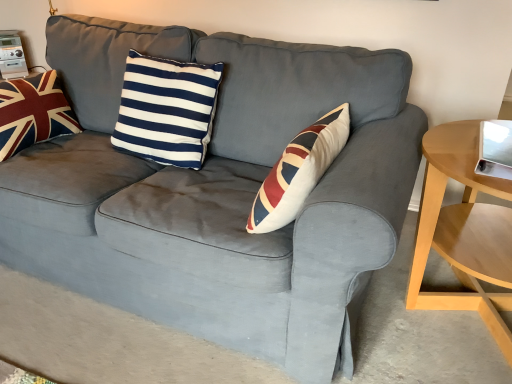
Question: Does light wood/woodenobject at right turn towards navy/white striped cushion at center, the 1th pillow positioned from the right?

Choices:
 (A) no
 (B) yes

Answer: (A)

Question: From the image's perspective, is light wood/woodenobject at right under navy/white striped cushion at center, the 1th pillow positioned from the right?

Choices:
 (A) yes
 (B) no

Answer: (A)

Question: Is light wood/woodenobject at right closer to camera compared to navy/white striped cushion at center, which ranks as the second pillow in left-to-right order?

Choices:
 (A) no
 (B) yes

Answer: (B)

Question: Is light wood/woodenobject at right far from navy/white striped cushion at center, the 1th pillow positioned from the right?

Choices:
 (A) yes
 (B) no

Answer: (B)

Question: Is light wood/woodenobject at right turned away from navy/white striped cushion at center, the 1th pillow positioned from the right?

Choices:
 (A) no
 (B) yes

Answer: (A)

Question: From a real-world perspective, is velvet union jack pillow at left, placed as the 1th pillow when sorted from left to right, above or below navy/white striped cushion at center, which ranks as the second pillow in left-to-right order?

Choices:
 (A) below
 (B) above

Answer: (A)

Question: Is velvet union jack pillow at left, which ranks as the second pillow in right-to-left order, bigger or smaller than navy/white striped cushion at center, which ranks as the second pillow in left-to-right order?

Choices:
 (A) small
 (B) big

Answer: (A)

Question: From the image's perspective, is velvet union jack pillow at left, which ranks as the second pillow in right-to-left order, positioned above or below navy/white striped cushion at center, the 1th pillow positioned from the right?

Choices:
 (A) below
 (B) above

Answer: (B)

Question: Considering the positions of point (42, 74) and point (153, 64), is point (42, 74) closer or farther from the camera than point (153, 64)?

Choices:
 (A) farther
 (B) closer

Answer: (A)

Question: From the image's perspective, is navy/white striped cushion at center, which ranks as the second pillow in left-to-right order, positioned above or below light wood/woodenobject at right?

Choices:
 (A) above
 (B) below

Answer: (A)

Question: Considering the positions of navy/white striped cushion at center, the 1th pillow positioned from the right, and light wood/woodenobject at right in the image, is navy/white striped cushion at center, the 1th pillow positioned from the right, bigger or smaller than light wood/woodenobject at right?

Choices:
 (A) big
 (B) small

Answer: (B)

Question: Relative to light wood/woodenobject at right, is navy/white striped cushion at center, which ranks as the second pillow in left-to-right order, in front or behind?

Choices:
 (A) behind
 (B) front

Answer: (A)

Question: Considering the positions of navy/white striped cushion at center, the 1th pillow positioned from the right, and light wood/woodenobject at right in the image, is navy/white striped cushion at center, the 1th pillow positioned from the right, taller or shorter than light wood/woodenobject at right?

Choices:
 (A) tall
 (B) short

Answer: (B)

Question: From a real-world perspective, is navy/white striped cushion at center, which ranks as the second pillow in left-to-right order, physically located above or below velvet union jack pillow at left, placed as the 1th pillow when sorted from left to right?

Choices:
 (A) above
 (B) below

Answer: (A)

Question: From the image's perspective, relative to velvet union jack pillow at left, which ranks as the second pillow in right-to-left order, is navy/white striped cushion at center, the 1th pillow positioned from the right, above or below?

Choices:
 (A) below
 (B) above

Answer: (A)